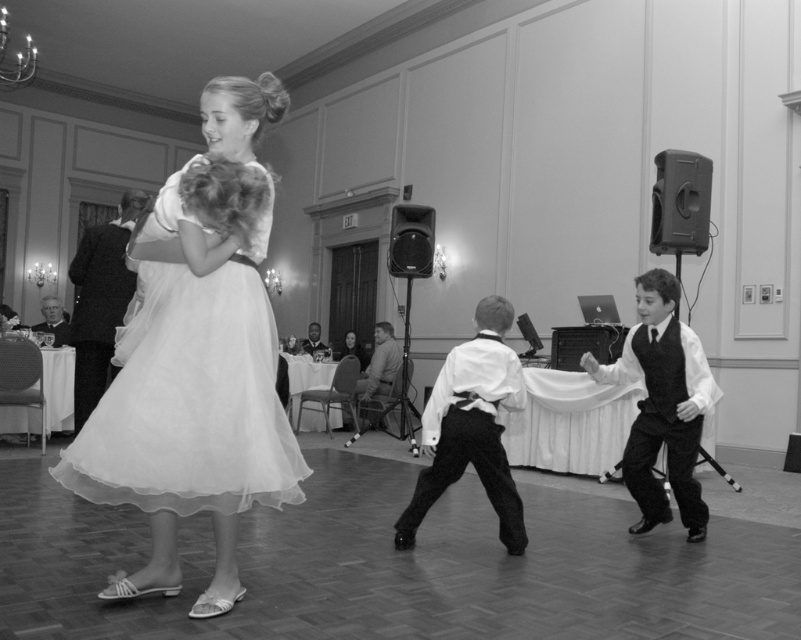
Question: Which object is positioned farthest from the matte white dress at center?

Choices:
 (A) white satin shirt at center
 (B) metallic speaker at right
 (C) formal black vest at right

Answer: (B)

Question: Does formal black vest at right have a greater width compared to metallic speaker at right?

Choices:
 (A) no
 (B) yes

Answer: (B)

Question: Which point is farther to the camera?

Choices:
 (A) (683, 241)
 (B) (592, 369)

Answer: (A)

Question: Can you confirm if matte white dress at center is wider than metallic black speaker at center?

Choices:
 (A) no
 (B) yes

Answer: (B)

Question: Which of the following is the closest to the observer?

Choices:
 (A) (207, 483)
 (B) (485, 417)
 (C) (641, 353)

Answer: (A)

Question: Can you confirm if metallic speaker at right is bigger than metallic black speaker at center?

Choices:
 (A) no
 (B) yes

Answer: (B)